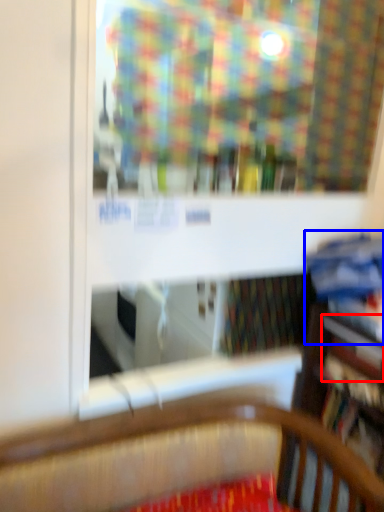
Question: Which object is further to the camera taking this photo, book (highlighted by a red box) or book (highlighted by a blue box)?

Choices:
 (A) book
 (B) book

Answer: (A)